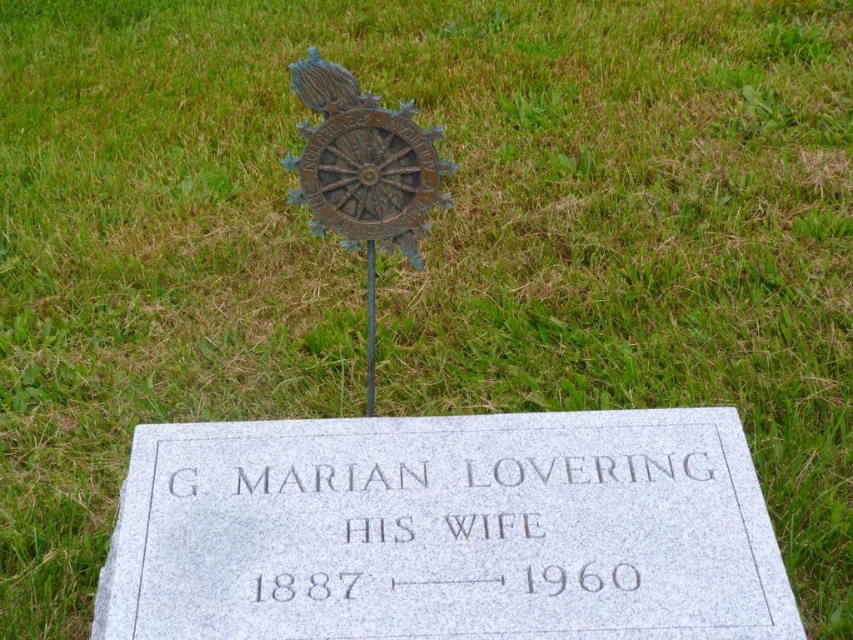
Question: Which point is closer to the camera?

Choices:
 (A) bronze/textured at center
 (B) granite at center

Answer: (B)

Question: Can you confirm if granite at center is positioned above bronze/textured at center?

Choices:
 (A) no
 (B) yes

Answer: (A)

Question: Among these points, which one is nearest to the camera?

Choices:
 (A) (368, 266)
 (B) (358, 620)

Answer: (B)

Question: Does granite at center appear over bronze/textured at center?

Choices:
 (A) yes
 (B) no

Answer: (B)

Question: Can you confirm if granite at center is positioned to the left of bronze/textured at center?

Choices:
 (A) yes
 (B) no

Answer: (B)